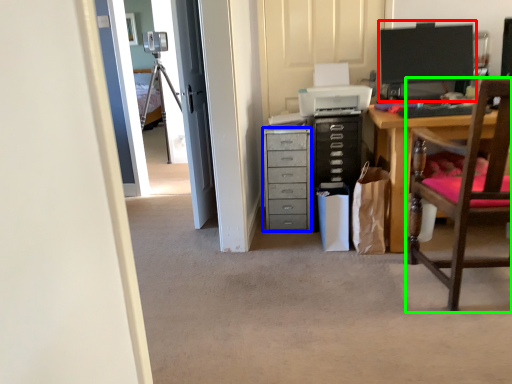
Question: Considering the real-world distances, which object is farthest from computer monitor (highlighted by a red box)? chest of drawers (highlighted by a blue box) or chair (highlighted by a green box)?

Choices:
 (A) chest of drawers
 (B) chair

Answer: (B)